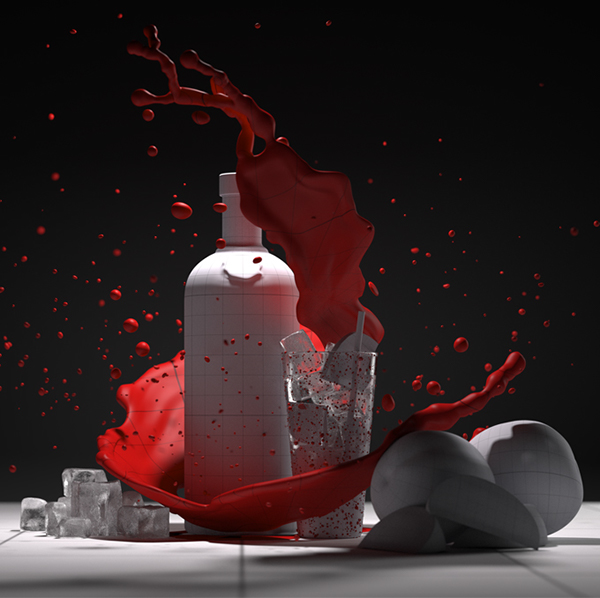
The height and width of the screenshot is (598, 600). In order to click on cup in this screenshot , I will do `click(350, 448)`.